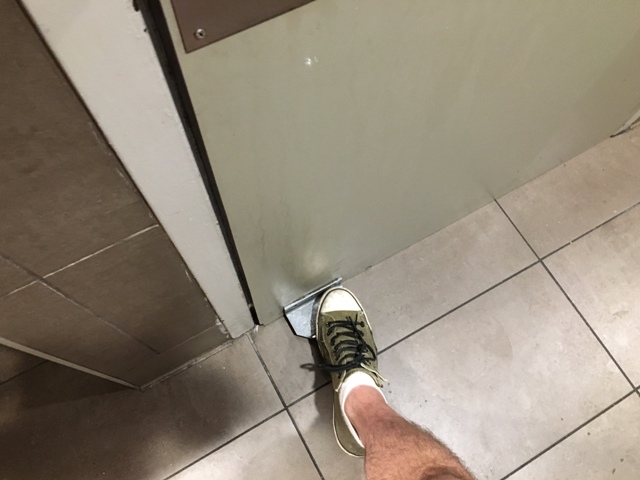
This screenshot has height=480, width=640. I want to click on door frame, so click(x=212, y=266).